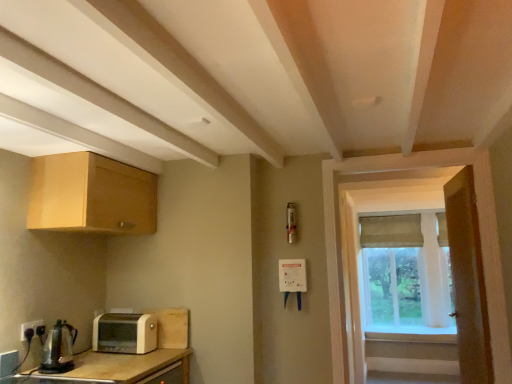
Question: Is beige fabric curtain at window closer to the viewer compared to light wood cabinet at upper left?

Choices:
 (A) yes
 (B) no

Answer: (B)

Question: Are beige fabric curtain at window and light wood cabinet at upper left beside each other?

Choices:
 (A) no
 (B) yes

Answer: (A)

Question: Is there a large distance between beige fabric curtain at window and light wood cabinet at upper left?

Choices:
 (A) yes
 (B) no

Answer: (A)

Question: Is beige fabric curtain at window further to the viewer compared to light wood cabinet at upper left?

Choices:
 (A) yes
 (B) no

Answer: (A)

Question: From a real-world perspective, is beige fabric curtain at window located higher than light wood cabinet at upper left?

Choices:
 (A) yes
 (B) no

Answer: (B)

Question: Is point (368, 274) closer or farther from the camera than point (29, 327)?

Choices:
 (A) closer
 (B) farther

Answer: (B)

Question: Which is correct: green fabric curtain at right is inside black plastic electrical outlet at lower left, or outside of it?

Choices:
 (A) inside
 (B) outside

Answer: (B)

Question: Is green fabric curtain at right to the left or to the right of black plastic electrical outlet at lower left in the image?

Choices:
 (A) right
 (B) left

Answer: (A)

Question: Considering the positions of green fabric curtain at right and black plastic electrical outlet at lower left in the image, is green fabric curtain at right wider or thinner than black plastic electrical outlet at lower left?

Choices:
 (A) wide
 (B) thin

Answer: (A)

Question: Is wooden door at right taller or shorter than green fabric curtain at right?

Choices:
 (A) tall
 (B) short

Answer: (A)

Question: From a real-world perspective, is wooden door at right positioned above or below green fabric curtain at right?

Choices:
 (A) above
 (B) below

Answer: (B)

Question: Choose the correct answer: Is wooden door at right inside green fabric curtain at right or outside it?

Choices:
 (A) inside
 (B) outside

Answer: (B)

Question: From the image's perspective, is wooden door at right above or below green fabric curtain at right?

Choices:
 (A) above
 (B) below

Answer: (A)

Question: In the image, is green fabric curtain at right positioned in front of or behind light wood cabinet at upper left?

Choices:
 (A) behind
 (B) front

Answer: (A)

Question: Visually, is green fabric curtain at right positioned to the left or to the right of light wood cabinet at upper left?

Choices:
 (A) right
 (B) left

Answer: (A)